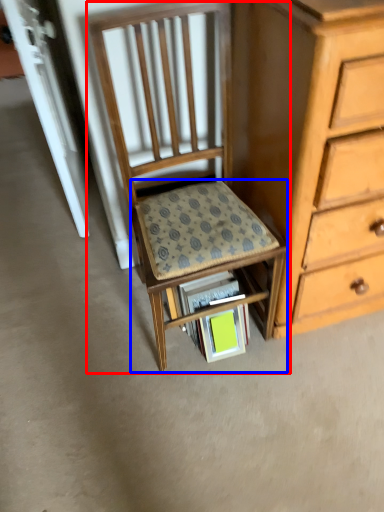
Question: Among these objects, which one is farthest to the camera, chair (highlighted by a red box) or step stool (highlighted by a blue box)?

Choices:
 (A) chair
 (B) step stool

Answer: (B)